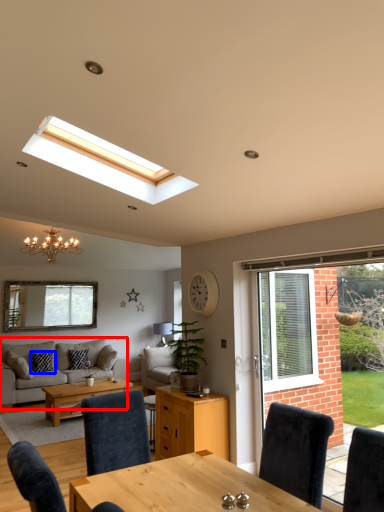
Question: Which object is further to the camera taking this photo, studio couch (highlighted by a red box) or pillow (highlighted by a blue box)?

Choices:
 (A) studio couch
 (B) pillow

Answer: (B)